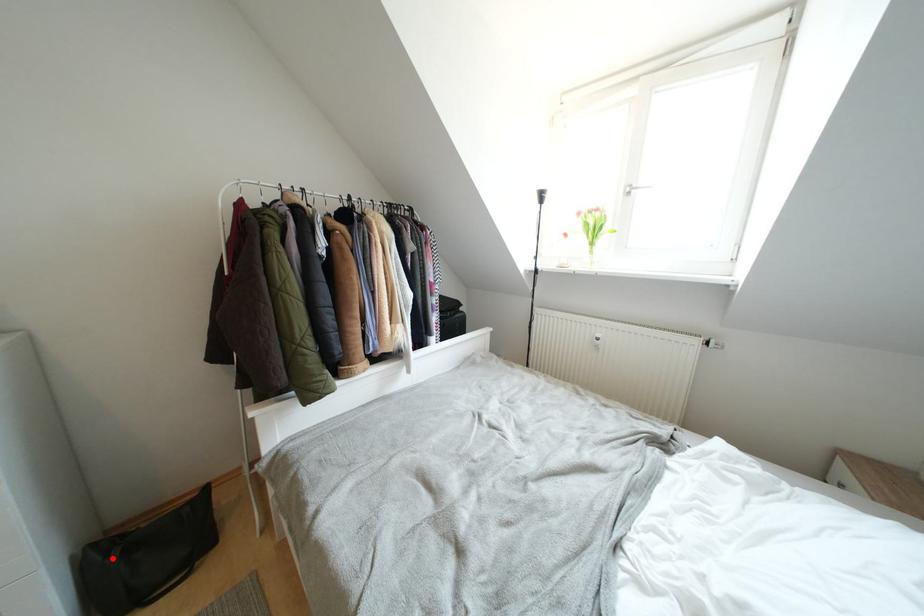
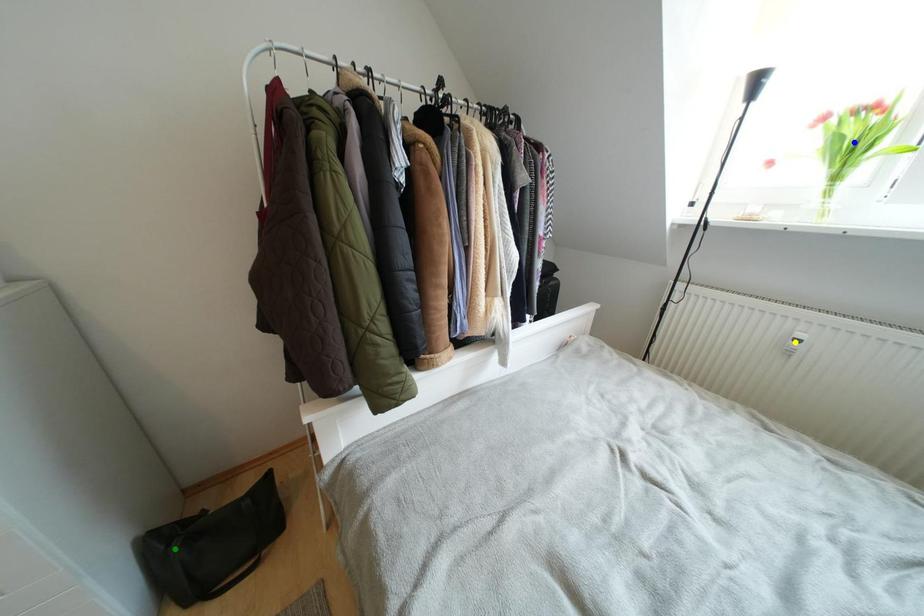
Question: I am providing you with two images of the same scene from different viewpoints. A red point is marked on the first image. You are given multiple points on the second image. Can you choose the point in image 2 that corresponds to the point in image 1?

Choices:
 (A) green point
 (B) yellow point
 (C) blue point

Answer: (A)